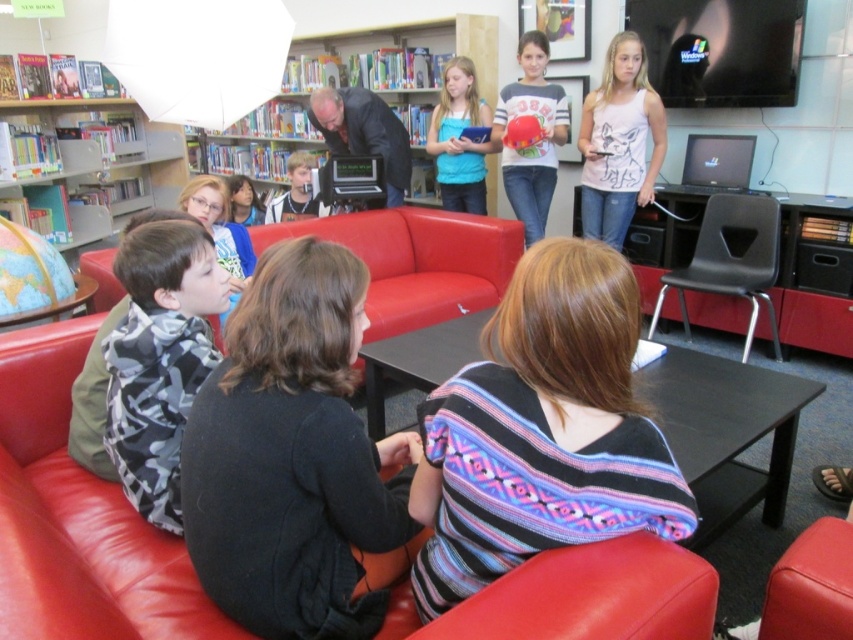
Can you confirm if black wool sweater at center is positioned to the left of striped knit sweater at center?

Correct, you'll find black wool sweater at center to the left of striped knit sweater at center.

Between point (292, 582) and point (482, 381), which one is positioned behind?

Positioned behind is point (292, 582).

Is point (222, 394) farther from camera compared to point (549, 324)?

Yes, point (222, 394) is farther from viewer.

You are a GUI agent. You are given a task and a screenshot of the screen. Output one action in this format:
    pyautogui.click(x=<x>, y=<y>)
    Task: Click on the black wool sweater at center
    The width and height of the screenshot is (853, 640).
    Given the screenshot: What is the action you would take?
    pyautogui.click(x=294, y=460)

Consider the image. Between leather couch at center and matte gray t-shirt at upper center, which one has more height?

With more height is matte gray t-shirt at upper center.

Which is more to the right, leather couch at center or matte gray t-shirt at upper center?

matte gray t-shirt at upper center is more to the right.

Where is `leather couch at center`? The image size is (853, 640). leather couch at center is located at coordinates (78, 518).

Locate an element on the screen. leather couch at center is located at coordinates 78,518.

Is the position of white tank top at upper right more distant than that of blue fabric shirt at center?

No, white tank top at upper right is in front of blue fabric shirt at center.

Which is in front, point (608, 225) or point (465, 145)?

Point (608, 225) is in front.

Identify the location of white tank top at upper right. (619, 141).